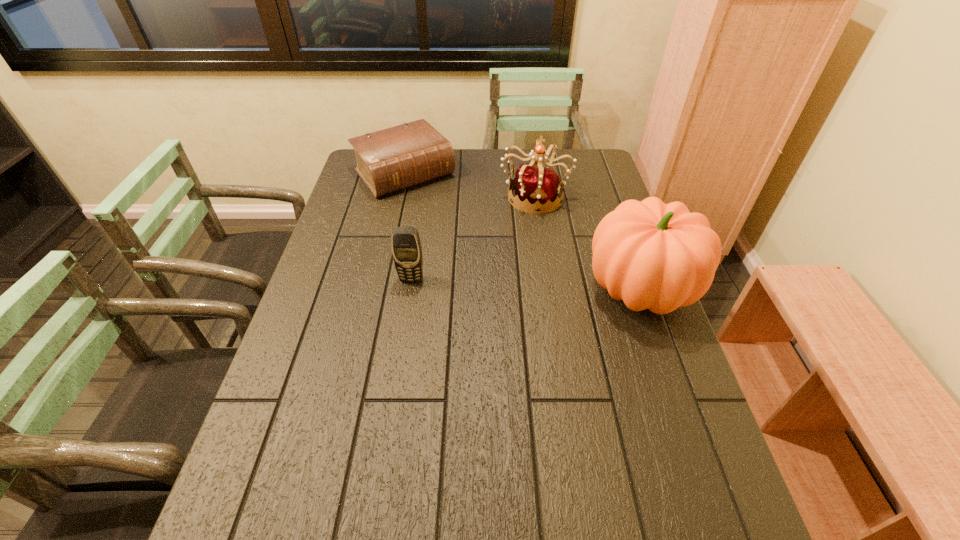
Find the location of `free spot at the left edge of the desktop`. free spot at the left edge of the desktop is located at coordinates (285, 370).

Identify the location of vacant space at the right edge of the desktop. The width and height of the screenshot is (960, 540). (698, 413).

The image size is (960, 540). In order to click on vacant area at the near left corner of the desktop in this screenshot , I will do `click(326, 466)`.

The height and width of the screenshot is (540, 960). I want to click on vacant area that lies between the pumpkin and the tiara, so click(x=587, y=242).

The height and width of the screenshot is (540, 960). In order to click on free spot between the pumpkin and the cellular telephone in this screenshot , I will do `click(525, 285)`.

The width and height of the screenshot is (960, 540). Find the location of `blank region between the third tallest object and the Bible`. blank region between the third tallest object and the Bible is located at coordinates (408, 226).

Locate an element on the screen. free space between the pumpkin and the shortest object is located at coordinates (522, 231).

Where is `free spot between the second tallest object and the cellular telephone`? Image resolution: width=960 pixels, height=540 pixels. free spot between the second tallest object and the cellular telephone is located at coordinates (473, 238).

I want to click on free space between the tiara and the Bible, so click(469, 185).

I want to click on free area in between the cellular telephone and the pumpkin, so click(x=525, y=285).